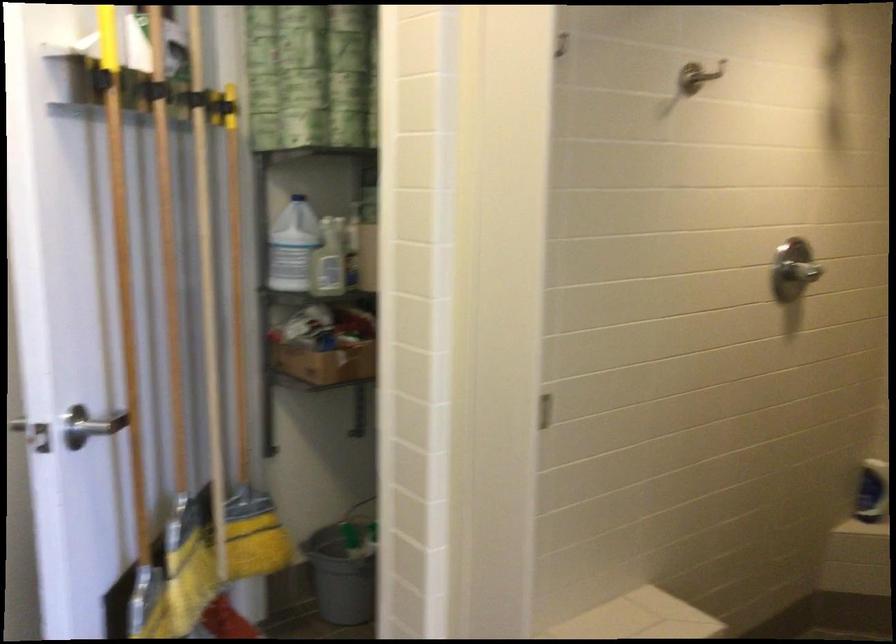
Identify the location of yellow push broom. (188, 330).